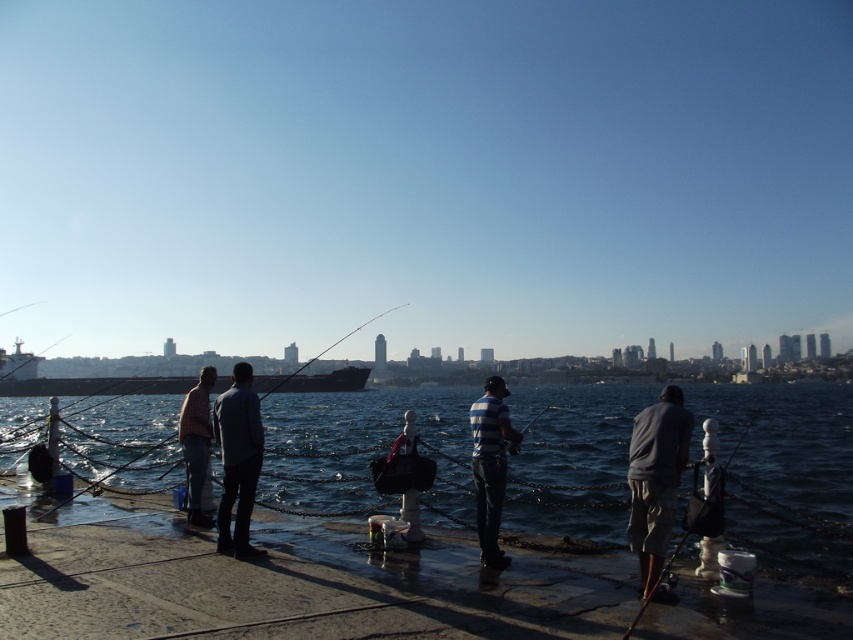
Question: Which of the following is the closest to the observer?

Choices:
 (A) gray fabric shorts at right
 (B) dark blue water at center
 (C) matte black fishing pole at right

Answer: (C)

Question: From the image, what is the correct spatial relationship of dark blue jeans at center in relation to matte black fishing pole at right?

Choices:
 (A) left
 (B) right

Answer: (A)

Question: Is dark blue water at center to the left of gray fabric shorts at right from the viewer's perspective?

Choices:
 (A) no
 (B) yes

Answer: (A)

Question: Considering the real-world distances, which object is closest to the gray fabric shorts at right?

Choices:
 (A) dark blue jeans at center
 (B) matte black fishing pole at right

Answer: (B)

Question: Is gray fabric shorts at right thinner than dark blue jeans at center?

Choices:
 (A) yes
 (B) no

Answer: (B)

Question: Which point appears farthest from the camera in this image?

Choices:
 (A) (496, 502)
 (B) (236, 602)
 (C) (585, 500)

Answer: (C)